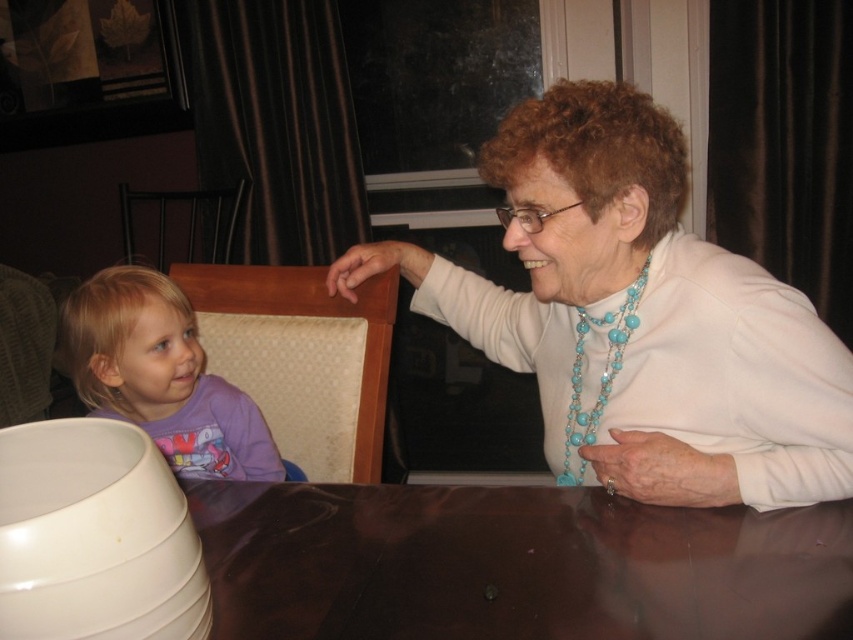
Does white glossy sweater at upper right have a greater width compared to purple cotton shirt at left?

Yes.

Who is positioned more to the left, white glossy sweater at upper right or purple cotton shirt at left?

From the viewer's perspective, purple cotton shirt at left appears more on the left side.

Find the location of `white glossy sweater at upper right`. white glossy sweater at upper right is located at coordinates (637, 316).

Who is positioned more to the right, glossy brown table at center or purple cotton shirt at left?

glossy brown table at center

Who is lower down, glossy brown table at center or purple cotton shirt at left?

glossy brown table at center

Where is `glossy brown table at center`? The width and height of the screenshot is (853, 640). glossy brown table at center is located at coordinates (514, 564).

How much distance is there between white glossy sweater at upper right and glossy brown table at center?

white glossy sweater at upper right and glossy brown table at center are 9.90 inches apart.

From the picture: Is white glossy sweater at upper right shorter than glossy brown table at center?

No, white glossy sweater at upper right is not shorter than glossy brown table at center.

Who is more forward, (550, 134) or (532, 604)?

Point (532, 604) is in front.

Where is `white glossy sweater at upper right`? The height and width of the screenshot is (640, 853). white glossy sweater at upper right is located at coordinates (637, 316).